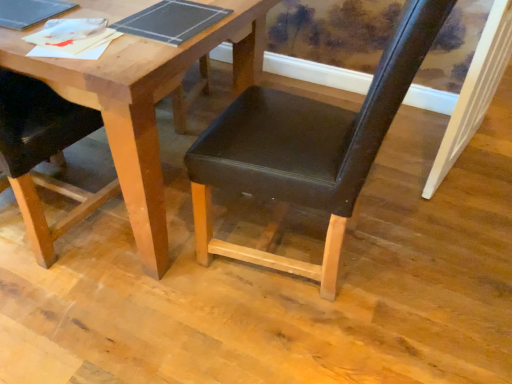
Question: From a real-world perspective, is matte black chair at center, placed as the second chair when sorted from left to right, physically below matte black chair at left, the second chair from the right?

Choices:
 (A) yes
 (B) no

Answer: (B)

Question: Considering the relative sizes of matte black chair at center, the first chair positioned from the right, and matte black chair at left, arranged as the 1th chair when viewed from the left, in the image provided, is matte black chair at center, the first chair positioned from the right, shorter than matte black chair at left, arranged as the 1th chair when viewed from the left,?

Choices:
 (A) no
 (B) yes

Answer: (A)

Question: Considering the relative positions of matte black chair at center, placed as the second chair when sorted from left to right, and matte black chair at left, arranged as the 1th chair when viewed from the left, in the image provided, is matte black chair at center, placed as the second chair when sorted from left to right, to the right of matte black chair at left, arranged as the 1th chair when viewed from the left, from the viewer's perspective?

Choices:
 (A) yes
 (B) no

Answer: (A)

Question: From a real-world perspective, does matte black chair at center, placed as the second chair when sorted from left to right, stand above matte black chair at left, the second chair from the right?

Choices:
 (A) yes
 (B) no

Answer: (A)

Question: Considering the relative positions of matte black chair at center, the first chair positioned from the right, and matte black chair at left, the second chair from the right, in the image provided, is matte black chair at center, the first chair positioned from the right, to the left of matte black chair at left, the second chair from the right, from the viewer's perspective?

Choices:
 (A) yes
 (B) no

Answer: (B)

Question: Which is correct: white painted wood door frame at right is inside matte black chair at left, the second chair from the right, or outside of it?

Choices:
 (A) outside
 (B) inside

Answer: (A)

Question: Is point (474, 100) positioned closer to the camera than point (58, 188)?

Choices:
 (A) farther
 (B) closer

Answer: (B)

Question: From the image's perspective, is white painted wood door frame at right located above or below matte black chair at left, the second chair from the right?

Choices:
 (A) above
 (B) below

Answer: (A)

Question: Looking at the image, does white painted wood door frame at right seem bigger or smaller compared to matte black chair at left, arranged as the 1th chair when viewed from the left?

Choices:
 (A) small
 (B) big

Answer: (A)

Question: Is matte black chair at center, the first chair positioned from the right, to the left or to the right of white painted wood door frame at right in the image?

Choices:
 (A) left
 (B) right

Answer: (A)

Question: Based on their sizes in the image, would you say matte black chair at center, the first chair positioned from the right, is bigger or smaller than white painted wood door frame at right?

Choices:
 (A) small
 (B) big

Answer: (B)

Question: From a real-world perspective, is matte black chair at center, placed as the second chair when sorted from left to right, above or below white painted wood door frame at right?

Choices:
 (A) above
 (B) below

Answer: (A)

Question: Does point click(329, 173) appear closer or farther from the camera than point click(488, 44)?

Choices:
 (A) farther
 (B) closer

Answer: (B)

Question: Would you say matte black chair at left, arranged as the 1th chair when viewed from the left, is to the left or to the right of wooden table at center in the picture?

Choices:
 (A) right
 (B) left

Answer: (A)

Question: Considering their positions, is matte black chair at left, arranged as the 1th chair when viewed from the left, located in front of or behind wooden table at center?

Choices:
 (A) front
 (B) behind

Answer: (A)